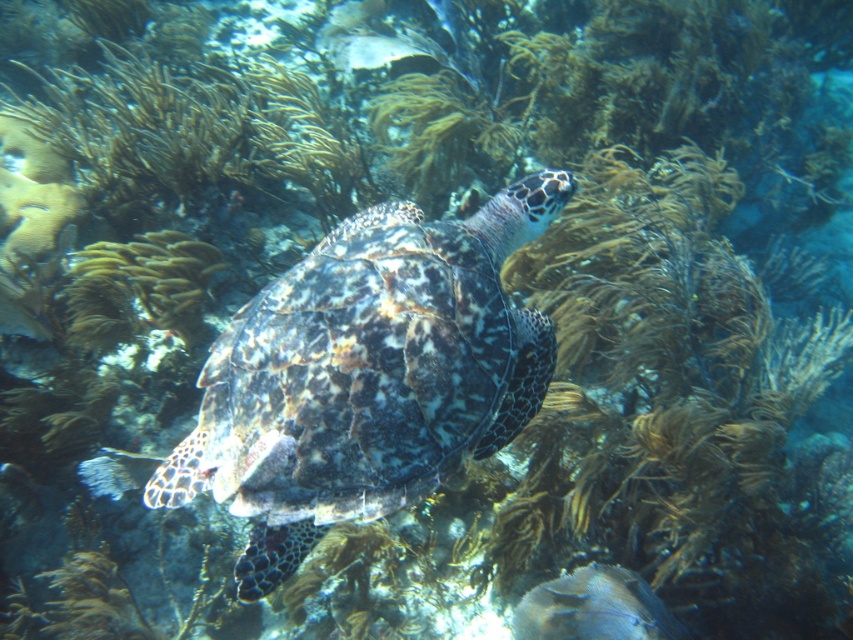
Does speckled shell turtle at center appear on the left side of brown textured coral at center?

In fact, speckled shell turtle at center is to the right of brown textured coral at center.

Is speckled shell turtle at center smaller than brown textured coral at center?

No, speckled shell turtle at center is not smaller than brown textured coral at center.

Which is in front, point (418, 273) or point (167, 273)?

Point (418, 273)

Locate an element on the screen. The height and width of the screenshot is (640, 853). speckled shell turtle at center is located at coordinates (x=366, y=376).